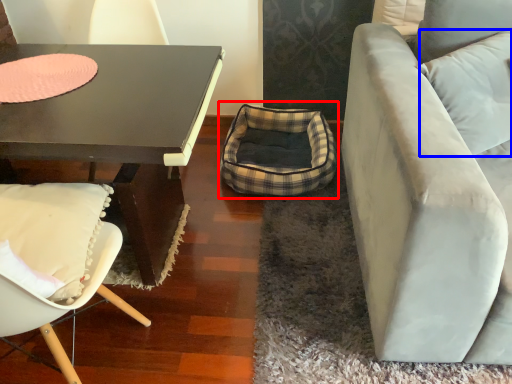
Question: Which object is further to the camera taking this photo, bean bag chair (highlighted by a red box) or pillow (highlighted by a blue box)?

Choices:
 (A) bean bag chair
 (B) pillow

Answer: (A)